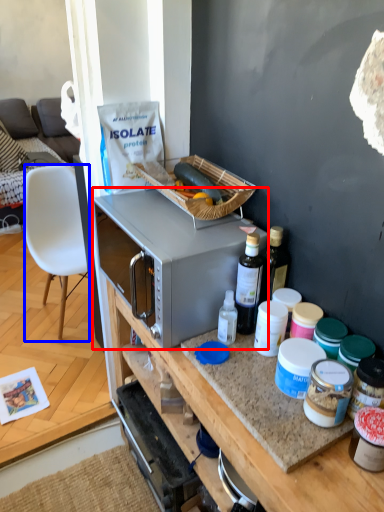
Question: Which object is further to the camera taking this photo, microwave oven (highlighted by a red box) or chair (highlighted by a blue box)?

Choices:
 (A) microwave oven
 (B) chair

Answer: (B)